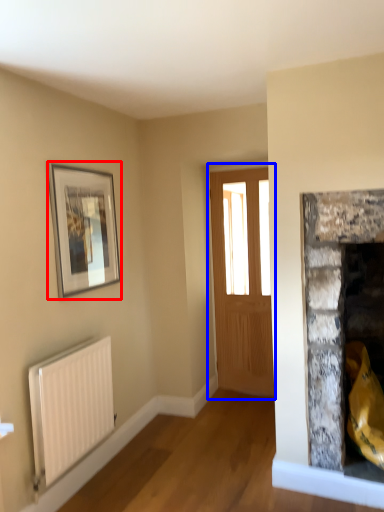
Question: Among these objects, which one is nearest to the camera, picture frame (highlighted by a red box) or window (highlighted by a blue box)?

Choices:
 (A) picture frame
 (B) window

Answer: (A)